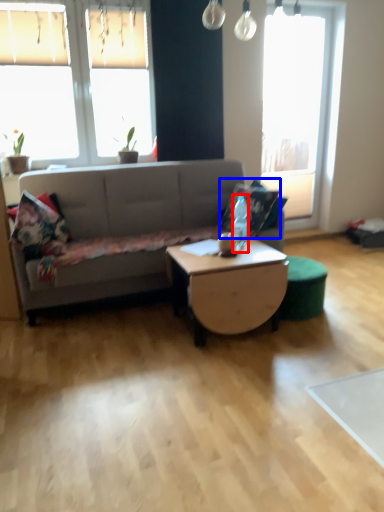
Question: Which object appears closest to the camera in this image, bottle (highlighted by a red box) or pillow (highlighted by a blue box)?

Choices:
 (A) bottle
 (B) pillow

Answer: (A)